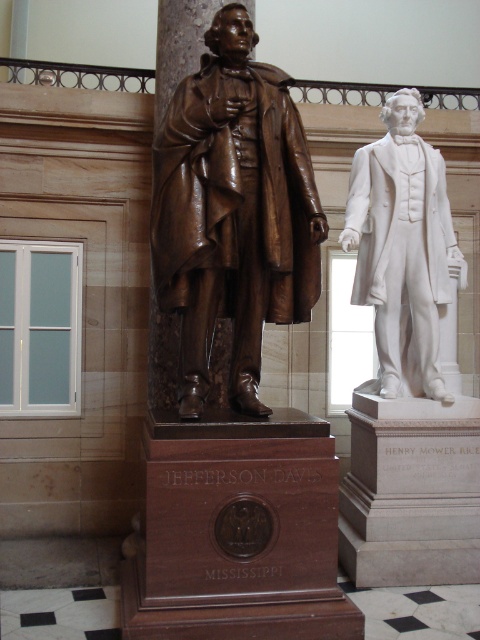
Question: Can you confirm if bronze statue at center is positioned to the left of white marble statue at right?

Choices:
 (A) yes
 (B) no

Answer: (A)

Question: Does bronze statue at center appear on the right side of white marble statue at right?

Choices:
 (A) yes
 (B) no

Answer: (B)

Question: Among these objects, which one is farthest from the camera?

Choices:
 (A) white marble statue at right
 (B) bronze statue at center

Answer: (A)

Question: Can you confirm if bronze statue at center is positioned to the left of white marble statue at right?

Choices:
 (A) no
 (B) yes

Answer: (B)